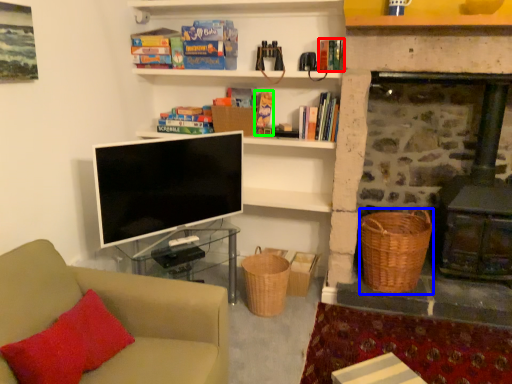
Question: Which is nearer to the book (highlighted by a red box)? basket (highlighted by a blue box) or book (highlighted by a green box).

Choices:
 (A) basket
 (B) book

Answer: (B)